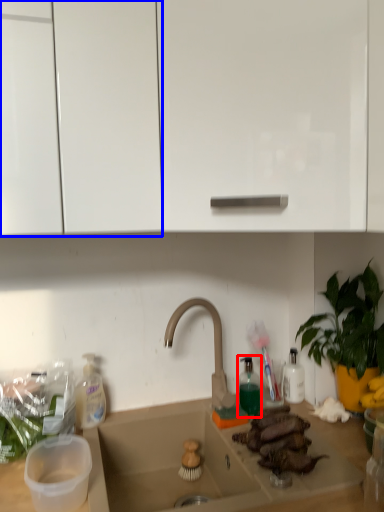
Question: Which of the following is the farthest to the observer, bottle (highlighted by a red box) or cabinetry (highlighted by a blue box)?

Choices:
 (A) bottle
 (B) cabinetry

Answer: (A)